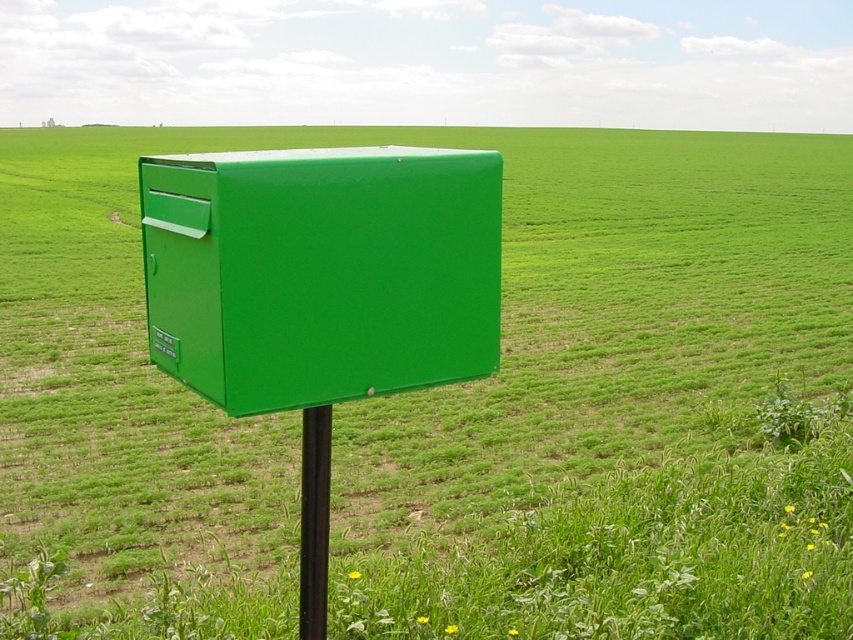
Question: Does green glossy mailbox at center have a lesser width compared to black metal pole at center?

Choices:
 (A) yes
 (B) no

Answer: (B)

Question: Does green glossy mailbox at center appear on the left side of black metal pole at center?

Choices:
 (A) no
 (B) yes

Answer: (A)

Question: Which point is closer to the camera?

Choices:
 (A) (276, 308)
 (B) (323, 502)

Answer: (A)

Question: Is green glossy mailbox at center thinner than black metal pole at center?

Choices:
 (A) no
 (B) yes

Answer: (A)